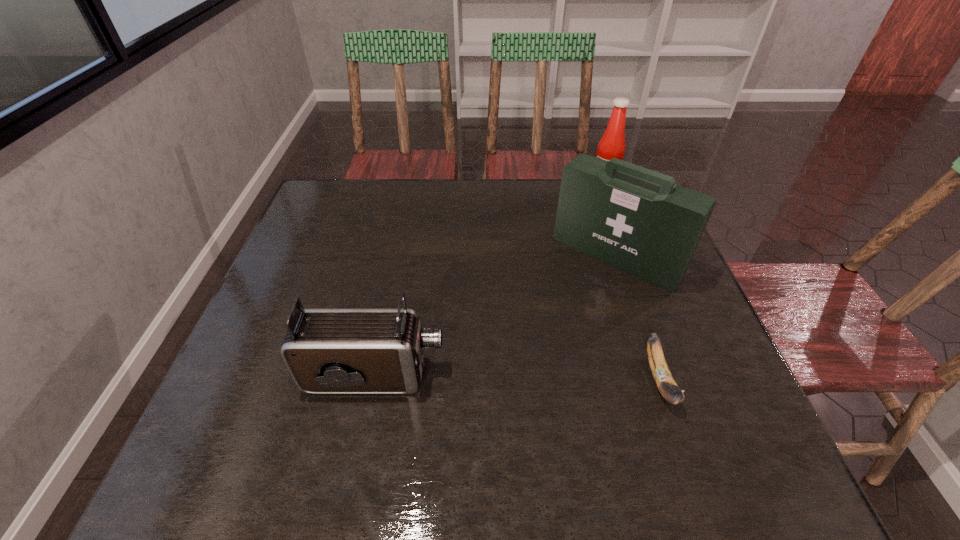
Locate an element on the screen. This screenshot has width=960, height=540. vacant space that is in between the third nearest object and the shortest object is located at coordinates (637, 318).

You are a GUI agent. You are given a task and a screenshot of the screen. Output one action in this format:
    pyautogui.click(x=<x>, y=<y>)
    Task: Click on the vacant region between the shortest object and the second shortest object
    
    Given the screenshot: What is the action you would take?
    pyautogui.click(x=517, y=378)

Identify the location of free space between the shortest object and the condiment. (631, 284).

Where is `free space between the leftmost object and the condiment`? This screenshot has height=540, width=960. free space between the leftmost object and the condiment is located at coordinates (489, 281).

The image size is (960, 540). I want to click on free space that is in between the banana and the camcorder, so click(517, 378).

I want to click on empty space between the shortest object and the second farthest object, so click(x=637, y=318).

You are a GUI agent. You are given a task and a screenshot of the screen. Output one action in this format:
    pyautogui.click(x=<x>, y=<y>)
    Task: Click on the free space between the third nearest object and the camcorder
    
    Given the screenshot: What is the action you would take?
    click(x=495, y=316)

You are a GUI agent. You are given a task and a screenshot of the screen. Output one action in this format:
    pyautogui.click(x=<x>, y=<y>)
    Task: Click on the object identified as the closest to the shortest object
    The width and height of the screenshot is (960, 540).
    Given the screenshot: What is the action you would take?
    pyautogui.click(x=635, y=219)

Where is `object that is the second nearest to the leftmost object`? The image size is (960, 540). object that is the second nearest to the leftmost object is located at coordinates (662, 376).